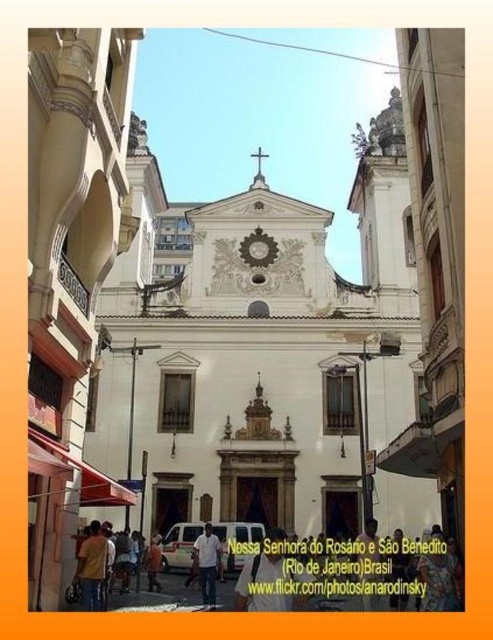
Which is more to the right, white matte shirt at center or matte gold clock at center?

matte gold clock at center is more to the right.

Who is more forward, [218,545] or [269,262]?

Point [218,545] is in front.

Image resolution: width=493 pixels, height=640 pixels. Find the location of `white matte shirt at center`. white matte shirt at center is located at coordinates (207, 564).

I want to click on white matte shirt at center, so click(x=207, y=564).

Does white marble church at center have a larger size compared to matte gold clock at center?

Indeed, white marble church at center has a larger size compared to matte gold clock at center.

Is white marble church at center below matte gold clock at center?

Yes, white marble church at center is below matte gold clock at center.

Describe the element at coordinates (253, 356) in the screenshot. The image size is (493, 640). I see `white marble church at center` at that location.

The width and height of the screenshot is (493, 640). I want to click on white marble church at center, so click(253, 356).

Does yellow shirt at lower left appear on the left side of dark brown leather jacket at center?

Indeed, yellow shirt at lower left is positioned on the left side of dark brown leather jacket at center.

Is point (99, 608) farther from viewer compared to point (371, 600)?

No, it is in front of (371, 600).

Between point (103, 556) and point (374, 538), which one is positioned in front?

Positioned in front is point (103, 556).

Identify the location of yellow shirt at lower left. This screenshot has width=493, height=640. (92, 566).